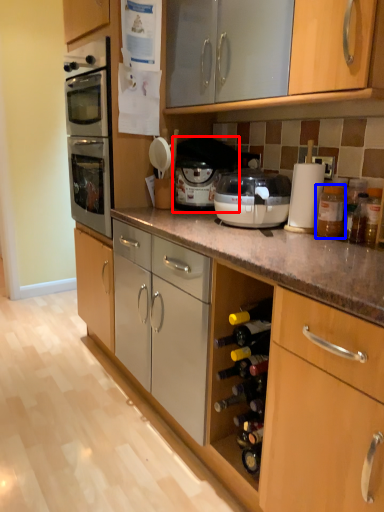
Question: Which of the following is the closest to the observer, appliance (highlighted by a red box) or bottle (highlighted by a blue box)?

Choices:
 (A) appliance
 (B) bottle

Answer: (B)